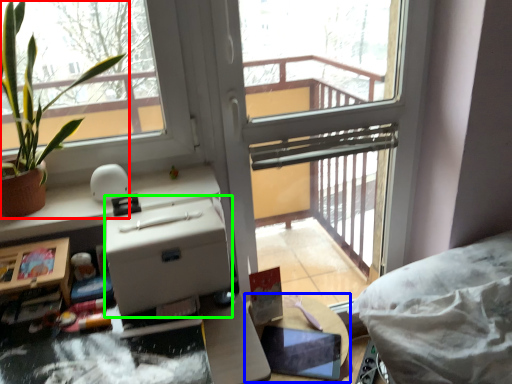
Question: Based on their relative distances, which object is nearer to houseplant (highlighted by a red box)? Choose from table (highlighted by a blue box) and cardboard box (highlighted by a green box).

Choices:
 (A) table
 (B) cardboard box

Answer: (B)